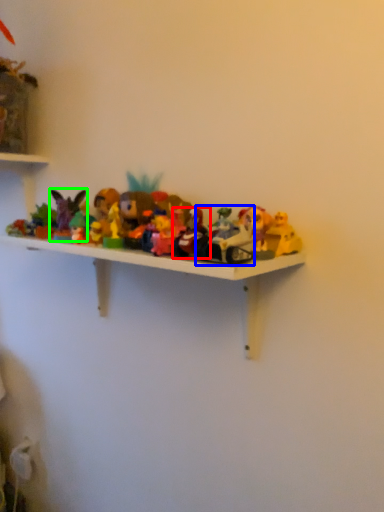
Question: Which object is the farthest from toy (highlighted by a red box)? Choose among these: toy (highlighted by a blue box) or toy (highlighted by a green box).

Choices:
 (A) toy
 (B) toy

Answer: (B)